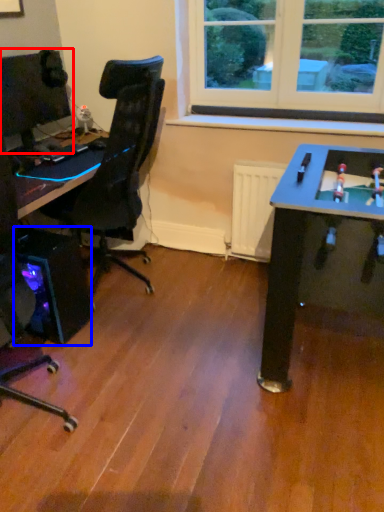
Question: Which point is further to the camera, computer monitor (highlighted by a red box) or computer tower (highlighted by a blue box)?

Choices:
 (A) computer monitor
 (B) computer tower

Answer: (A)